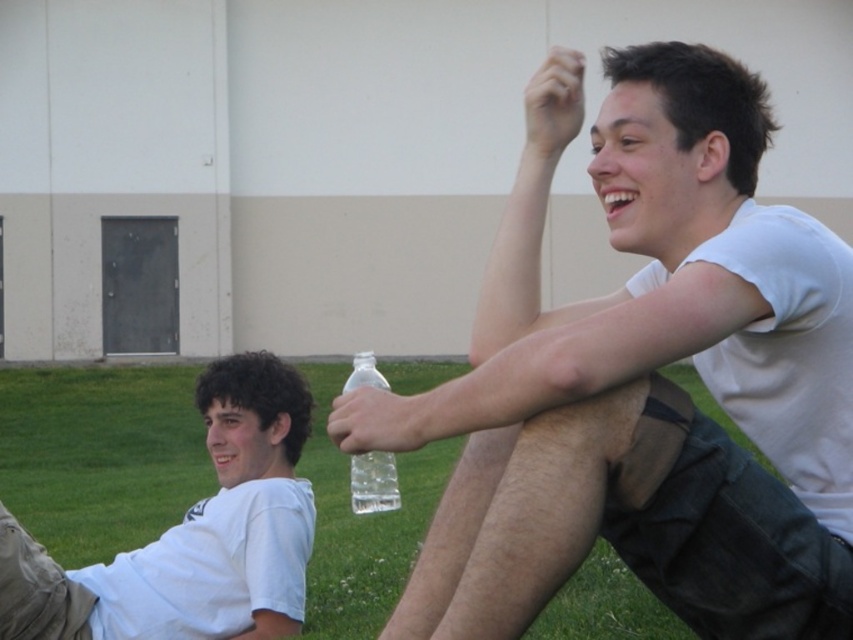
Question: Does green grass at lower center appear under transparent plastic bottle at center?

Choices:
 (A) yes
 (B) no

Answer: (A)

Question: Does white matte shirt at lower left have a lesser width compared to transparent plastic bottle at center?

Choices:
 (A) yes
 (B) no

Answer: (A)

Question: Which object appears farthest from the camera in this image?

Choices:
 (A) green grass at lower center
 (B) white matte shirt at upper right

Answer: (A)

Question: Which object is positioned closest to the transparent plastic bottle at center?

Choices:
 (A) green grass at lower center
 (B) white matte shirt at lower left
 (C) white matte shirt at upper right

Answer: (C)

Question: Can you confirm if green grass at lower center is positioned to the right of transparent plastic bottle at center?

Choices:
 (A) yes
 (B) no

Answer: (B)

Question: Based on their relative distances, which object is nearer to the transparent plastic bottle at center?

Choices:
 (A) green grass at lower center
 (B) white matte shirt at upper right

Answer: (B)